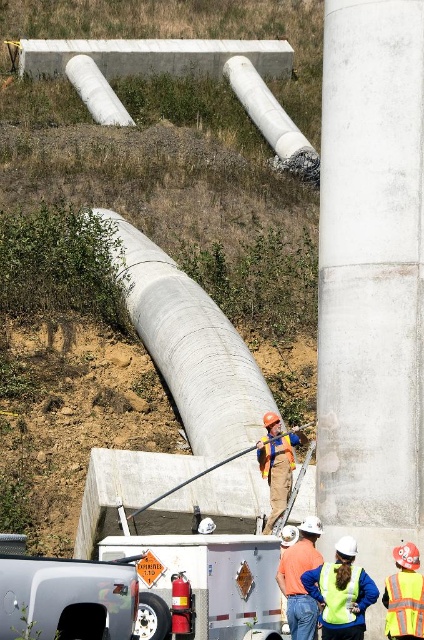
Question: Does orange hard hat at center have a lesser width compared to reflective yellow safety vest at center?

Choices:
 (A) yes
 (B) no

Answer: (B)

Question: Does white concrete pillar at center appear on the right side of reflective fabric safety vest at center?

Choices:
 (A) yes
 (B) no

Answer: (B)

Question: Which point is closer to the camera taking this photo?

Choices:
 (A) (169, 589)
 (B) (279, 435)

Answer: (A)

Question: Estimate the real-world distances between objects in this image. Which object is farther from the reflective yellow safety vest at lower right?

Choices:
 (A) reflective yellow safety vest at lower center
 (B) white glossy trailer truck at lower center
 (C) white concrete water pipe at upper center

Answer: (C)

Question: Does white glossy trailer truck at lower center have a larger size compared to reflective fabric safety vest at center?

Choices:
 (A) no
 (B) yes

Answer: (A)

Question: Which object is positioned closest to the orange safety vest at center?

Choices:
 (A) white glossy trailer truck at lower center
 (B) reflective fabric safety vest at center
 (C) white matte water pipe at upper center
 (D) reflective yellow safety vest at center

Answer: (B)